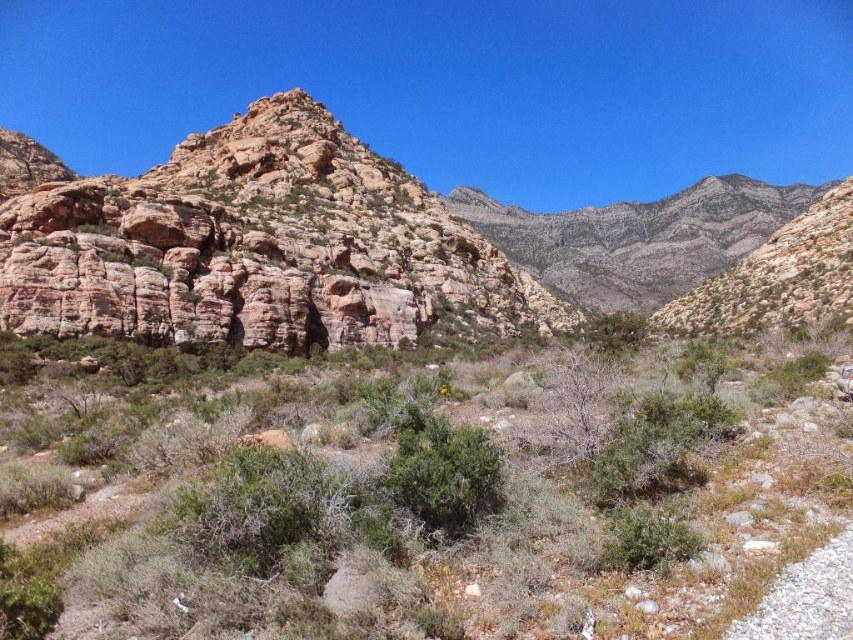
You are a hiker who has a 60 meter rope. You need to cross the gap between the green shrubs at center and the rusty rock formation at left. Can you safely use your rope to bridge the gap?

The distance between the green shrubs at center and the rusty rock formation at left is 65.71 meters. Since your rope is only 60 meters long, it is not long enough to safely bridge the gap.

You are a hiker standing at the starting point of the gravel path on the right side of the image. You want to reach the green shrubs at center. Which direction should you move relative to your current position?

The green shrubs at center are located at point (x=412, y=499), so you should move towards the center of the image from the gravel path on the right side to reach them.